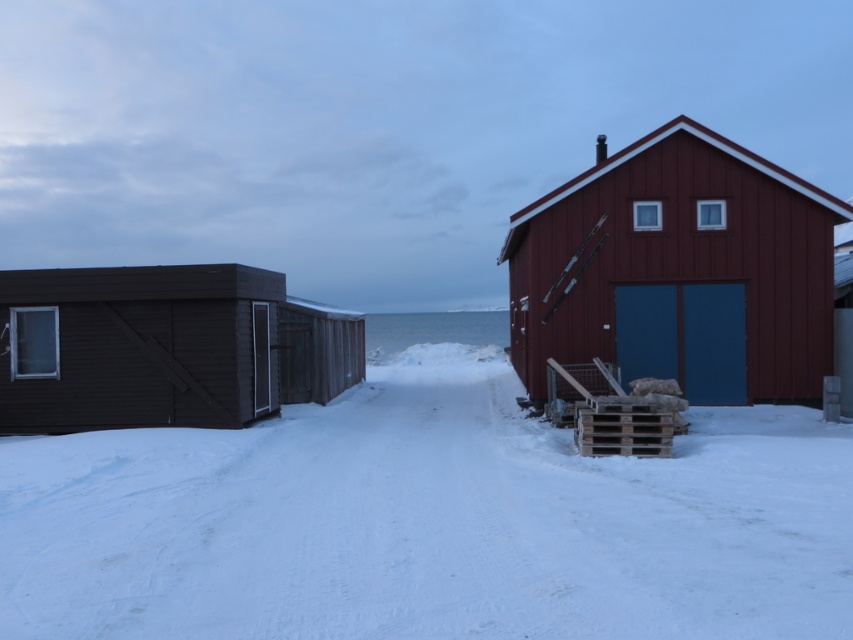
Question: Which of the following is the farthest from the observer?

Choices:
 (A) white powdery snow at center
 (B) matte red barn at right

Answer: (B)

Question: Which of the following is the closest to the observer?

Choices:
 (A) matte red barn at right
 (B) white powdery snow at center

Answer: (B)

Question: Does matte red barn at right appear on the right side of dark brown wood cabin at left?

Choices:
 (A) no
 (B) yes

Answer: (B)

Question: Among these points, which one is farthest from the camera?

Choices:
 (A) (619, 228)
 (B) (61, 397)
 (C) (604, 468)

Answer: (A)

Question: Does white powdery snow at center have a greater width compared to matte red barn at right?

Choices:
 (A) yes
 (B) no

Answer: (B)

Question: Is white powdery snow at center thinner than matte red barn at right?

Choices:
 (A) no
 (B) yes

Answer: (B)